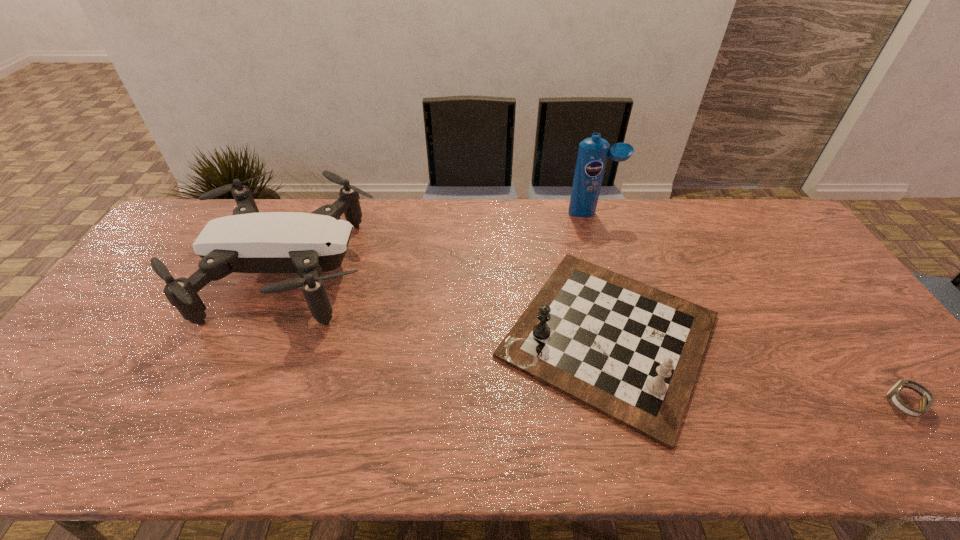
Where is `shampoo`? Image resolution: width=960 pixels, height=540 pixels. shampoo is located at coordinates (592, 156).

This screenshot has width=960, height=540. In order to click on drone in this screenshot , I will do `click(248, 241)`.

I want to click on the second tallest object, so click(x=248, y=241).

This screenshot has width=960, height=540. What are the coordinates of `the second shortest object` in the screenshot? It's located at (631, 352).

Where is `watch`? The image size is (960, 540). watch is located at coordinates (927, 400).

You are a GUI agent. You are given a task and a screenshot of the screen. Output one action in this format:
    pyautogui.click(x=<x>, y=<y>)
    Task: Click on the shortest object
    The width and height of the screenshot is (960, 540).
    Given the screenshot: What is the action you would take?
    pyautogui.click(x=927, y=400)

Where is `vacant point located 0.220m on the right of the tallest object`? vacant point located 0.220m on the right of the tallest object is located at coordinates (679, 213).

Image resolution: width=960 pixels, height=540 pixels. What are the coordinates of `blank space located on the camera side of the leftmost object` in the screenshot? It's located at (416, 270).

I want to click on vacant region located on the left of the gameboard, so click(x=425, y=336).

Where is `free space located on the face of the rightmost object`? The image size is (960, 540). free space located on the face of the rightmost object is located at coordinates (792, 404).